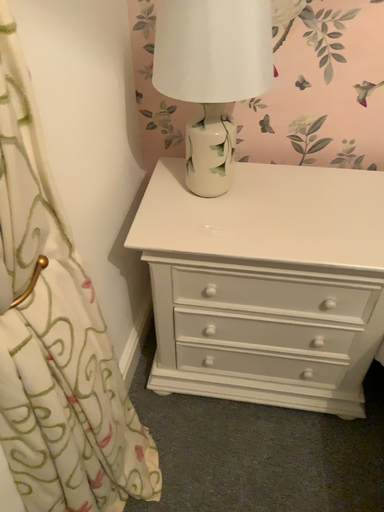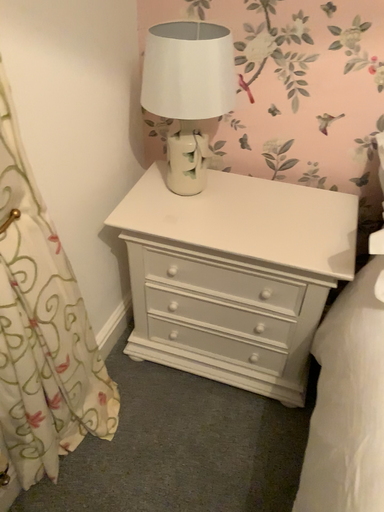
Question: Which way did the camera rotate in the video?

Choices:
 (A) rotated right
 (B) rotated left

Answer: (B)